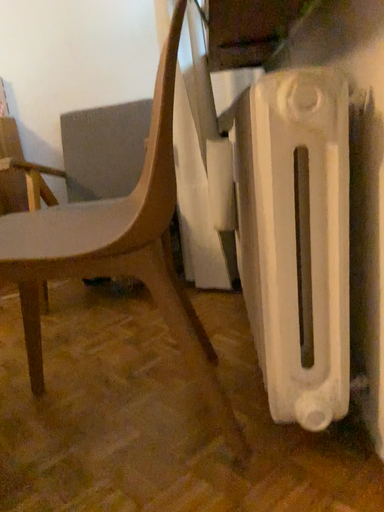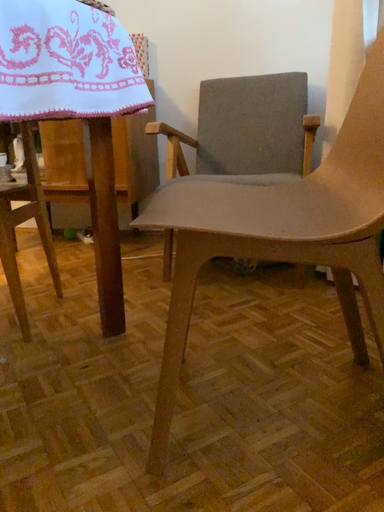
Question: Which way did the camera rotate in the video?

Choices:
 (A) rotated left
 (B) rotated right

Answer: (A)